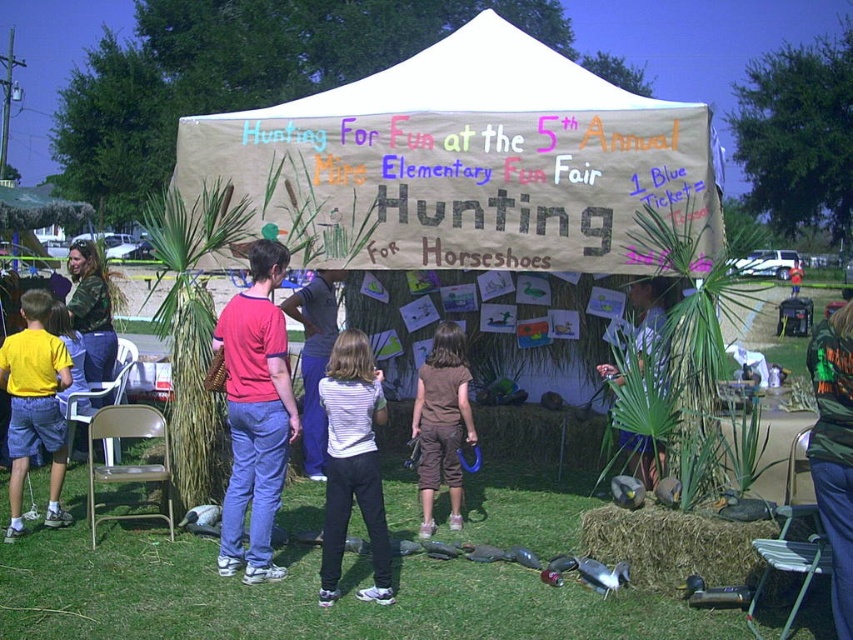
Based on the photo, which of these two, brown cotton shorts at center or camouflage jacket at center, stands taller?

With more height is brown cotton shorts at center.

Is brown cotton shorts at center positioned in front of camouflage jacket at center?

Yes, brown cotton shorts at center is in front of camouflage jacket at center.

Image resolution: width=853 pixels, height=640 pixels. What do you see at coordinates (440, 422) in the screenshot?
I see `brown cotton shorts at center` at bounding box center [440, 422].

I want to click on brown cotton shorts at center, so click(440, 422).

Image resolution: width=853 pixels, height=640 pixels. What are the coordinates of `red woven bag at center` in the screenshot? It's located at (254, 413).

What do you see at coordinates (254, 413) in the screenshot?
I see `red woven bag at center` at bounding box center [254, 413].

The height and width of the screenshot is (640, 853). I want to click on red woven bag at center, so click(254, 413).

Who is more distant from viewer, (277, 358) or (322, 356)?

Point (322, 356)

Can you confirm if red woven bag at center is smaller than red shirt at center?

Actually, red woven bag at center might be larger than red shirt at center.

I want to click on red woven bag at center, so click(254, 413).